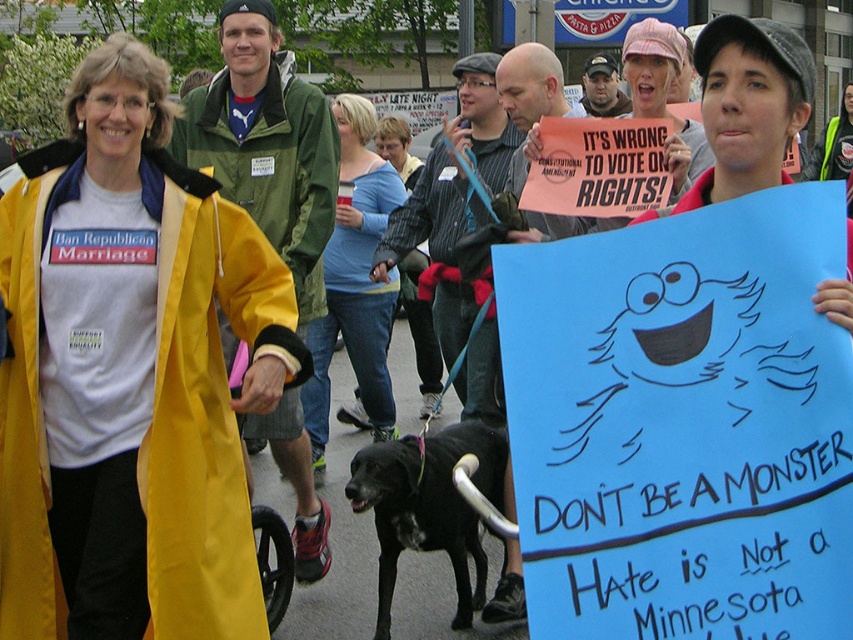
Question: Considering the real-world distances, which object is closest to the yellow matte raincoat at left?

Choices:
 (A) blue cotton shirt at center
 (B) black fur dog at center

Answer: (B)

Question: Where is yellow matte raincoat at left located in relation to blue cotton shirt at center in the image?

Choices:
 (A) right
 (B) left

Answer: (B)

Question: Which object appears closest to the camera in this image?

Choices:
 (A) black fur dog at center
 (B) blue cotton shirt at center
 (C) yellow matte raincoat at left

Answer: (C)

Question: Observing the image, what is the correct spatial positioning of blue cotton shirt at center in reference to black fur dog at center?

Choices:
 (A) above
 (B) below

Answer: (A)

Question: Does blue cotton shirt at center come in front of black fur dog at center?

Choices:
 (A) yes
 (B) no

Answer: (B)

Question: Which object is the closest to the black fur dog at center?

Choices:
 (A) yellow matte raincoat at left
 (B) blue cotton shirt at center

Answer: (A)